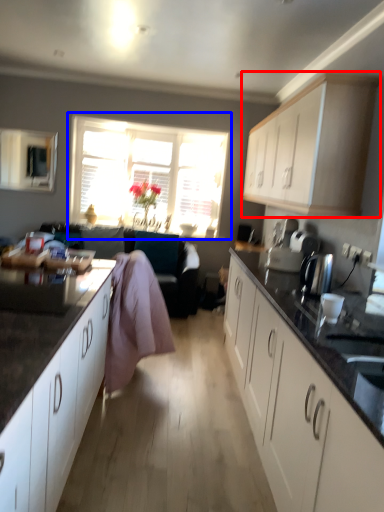
Question: Among these objects, which one is farthest to the camera, cabinetry (highlighted by a red box) or window (highlighted by a blue box)?

Choices:
 (A) cabinetry
 (B) window

Answer: (B)